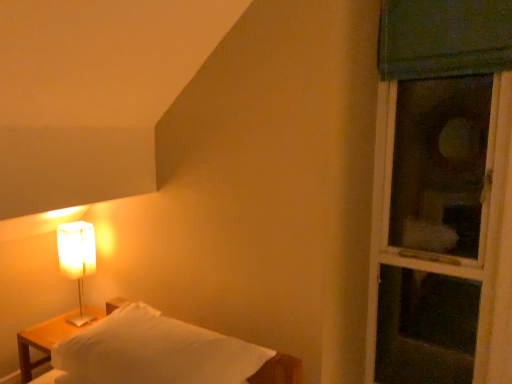
What do you see at coordinates (162, 353) in the screenshot? I see `white matte bed at lower left` at bounding box center [162, 353].

Measure the distance between point (89, 230) and camera.

2.38 meters.

Describe the element at coordinates (42, 341) in the screenshot. This screenshot has width=512, height=384. I see `wooden nightstand at left` at that location.

The width and height of the screenshot is (512, 384). I want to click on white matte bed at lower left, so click(162, 353).

Does point (62, 270) appear closer or farther from the camera than point (66, 316)?

Point (62, 270) is positioned farther from the camera compared to point (66, 316).

Would you consider white matte rectangular lamp at left to be distant from wooden nightstand at left?

white matte rectangular lamp at left is near wooden nightstand at left, not far away.

From the picture: From a real-world perspective, which object stands above the other?

white matte rectangular lamp at left.

Which of these two, white matte rectangular lamp at left or wooden nightstand at left, is smaller?

white matte rectangular lamp at left.

From the image's perspective, is green fabric window at right on white matte bed at lower left?

Yes, from the image's perspective, green fabric window at right is above white matte bed at lower left.

Find the location of `window behind the white matte bed at lower left`. window behind the white matte bed at lower left is located at coordinates (441, 194).

Which is in front, green fabric window at right or white matte bed at lower left?

white matte bed at lower left is in front.

From the image's perspective, is green fabric window at right above wooden nightstand at left?

Yes, from the image's perspective, green fabric window at right is over wooden nightstand at left.

Which of these two, green fabric window at right or wooden nightstand at left, is wider?

With larger width is wooden nightstand at left.

Is green fabric window at right oriented towards wooden nightstand at left?

No, green fabric window at right is not oriented towards wooden nightstand at left.

How distant is green fabric window at right from wooden nightstand at left?

A distance of 6.38 feet exists between green fabric window at right and wooden nightstand at left.

Which is more to the right, white matte bed at lower left or green fabric window at right?

Positioned to the right is green fabric window at right.

From the image's perspective, between white matte bed at lower left and green fabric window at right, which one is located above?

green fabric window at right.

Based on the photo, between white matte bed at lower left and green fabric window at right, which one has larger width?

Wider between the two is white matte bed at lower left.

Looking at this image, considering the sizes of objects white matte bed at lower left and green fabric window at right in the image provided, who is shorter, white matte bed at lower left or green fabric window at right?

Standing shorter between the two is white matte bed at lower left.

Consider the image. Measure the distance from wooden nightstand at left to green fabric window at right.

wooden nightstand at left is 1.95 meters away from green fabric window at right.

Considering the positions of point (60, 328) and point (495, 27), is point (60, 328) closer or farther from the camera than point (495, 27)?

Point (60, 328).

Which is more to the left, wooden nightstand at left or green fabric window at right?

Positioned to the left is wooden nightstand at left.

How many degrees apart are the facing directions of wooden nightstand at left and white matte bed at lower left?

164 degrees separate the facing orientations of wooden nightstand at left and white matte bed at lower left.

Measure the distance between wooden nightstand at left and white matte bed at lower left.

wooden nightstand at left is 31.10 inches from white matte bed at lower left.

Considering the sizes of objects wooden nightstand at left and white matte bed at lower left in the image provided, who is smaller, wooden nightstand at left or white matte bed at lower left?

With smaller size is wooden nightstand at left.

From a real-world perspective, is wooden nightstand at left physically above white matte bed at lower left?

No, from a real-world perspective, wooden nightstand at left is not on top of white matte bed at lower left.

From a real-world perspective, is green fabric window at right beneath white matte rectangular lamp at left?

Actually, green fabric window at right is physically above white matte rectangular lamp at left in the real world.

Does green fabric window at right contain white matte rectangular lamp at left?

No, white matte rectangular lamp at left is located outside of green fabric window at right.

Is green fabric window at right taller than white matte rectangular lamp at left?

Indeed, green fabric window at right has a greater height compared to white matte rectangular lamp at left.

Where is `nightstand on the left side of white matte rectangular lamp at left`? The image size is (512, 384). nightstand on the left side of white matte rectangular lamp at left is located at coordinates (42, 341).

Find the location of `window above the white matte bed at lower left (from the image's perspective)`. window above the white matte bed at lower left (from the image's perspective) is located at coordinates (441, 194).

Which object lies nearer to the anchor point white matte bed at lower left, white matte rectangular lamp at left or green fabric window at right?

white matte rectangular lamp at left is positioned closer to the anchor white matte bed at lower left.

When comparing their distances from white matte rectangular lamp at left, does white matte bed at lower left or wooden nightstand at left seem further?

white matte bed at lower left.

Based on their spatial positions, is wooden nightstand at left or green fabric window at right further from white matte bed at lower left?

Among the two, green fabric window at right is located further to white matte bed at lower left.

Estimate the real-world distances between objects in this image. Which object is further from wooden nightstand at left, white matte bed at lower left or green fabric window at right?

Among the two, green fabric window at right is located further to wooden nightstand at left.

Looking at the image, which one is located closer to white matte rectangular lamp at left, green fabric window at right or wooden nightstand at left?

wooden nightstand at left lies closer to white matte rectangular lamp at left than the other object.

When comparing their distances from white matte bed at lower left, does white matte rectangular lamp at left or wooden nightstand at left seem further?

white matte rectangular lamp at left lies further to white matte bed at lower left than the other object.

From the image, which object appears to be nearer to green fabric window at right, white matte rectangular lamp at left or white matte bed at lower left?

white matte bed at lower left lies closer to green fabric window at right than the other object.

Estimate the real-world distances between objects in this image. Which object is closer to white matte rectangular lamp at left, green fabric window at right or white matte bed at lower left?

white matte bed at lower left is positioned closer to the anchor white matte rectangular lamp at left.

The height and width of the screenshot is (384, 512). In order to click on nightstand positioned between white matte bed at lower left and white matte rectangular lamp at left from near to far in this screenshot , I will do `click(42, 341)`.

I want to click on lamp located between wooden nightstand at left and green fabric window at right in the left-right direction, so click(x=77, y=259).

Identify the location of furniture between white matte rectangular lamp at left and green fabric window at right from left to right. (162, 353).

At what (x,y) coordinates should I click in order to perform the action: click on furniture between wooden nightstand at left and green fabric window at right. Please return your answer as a coordinate pair (x, y). The height and width of the screenshot is (384, 512). Looking at the image, I should click on (162, 353).